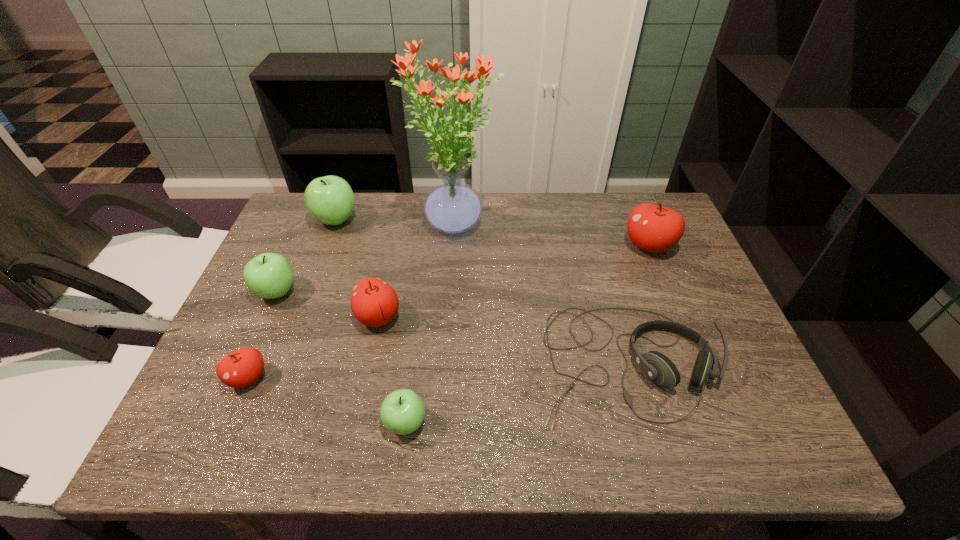
Locate an element on the screen. The image size is (960, 540). the leftmost red apple is located at coordinates (242, 367).

This screenshot has width=960, height=540. What are the coordinates of `the nearest apple` in the screenshot? It's located at (402, 412).

Where is `the rightmost green apple`? The width and height of the screenshot is (960, 540). the rightmost green apple is located at coordinates (402, 412).

Locate an element on the screen. The width and height of the screenshot is (960, 540). free space located on the front of the red flower arrangement is located at coordinates (451, 288).

The width and height of the screenshot is (960, 540). What are the coordinates of `vacant region located 0.190m on the left of the biggest red apple` in the screenshot? It's located at (557, 246).

Identify the location of free space located 0.210m on the right of the biggest green apple. (427, 220).

Locate an element on the screen. This screenshot has height=540, width=960. free point located 0.250m on the front of the second nearest green apple is located at coordinates (229, 399).

Where is `free space located on the back of the second nearest red apple`? free space located on the back of the second nearest red apple is located at coordinates (399, 220).

At what (x,y) coordinates should I click in order to perform the action: click on free space located on the back of the second nearest apple. Please return your answer as a coordinate pair (x, y). This screenshot has width=960, height=540. Looking at the image, I should click on (299, 261).

Locate an element on the screen. free spot located on the back of the nearest apple is located at coordinates (416, 338).